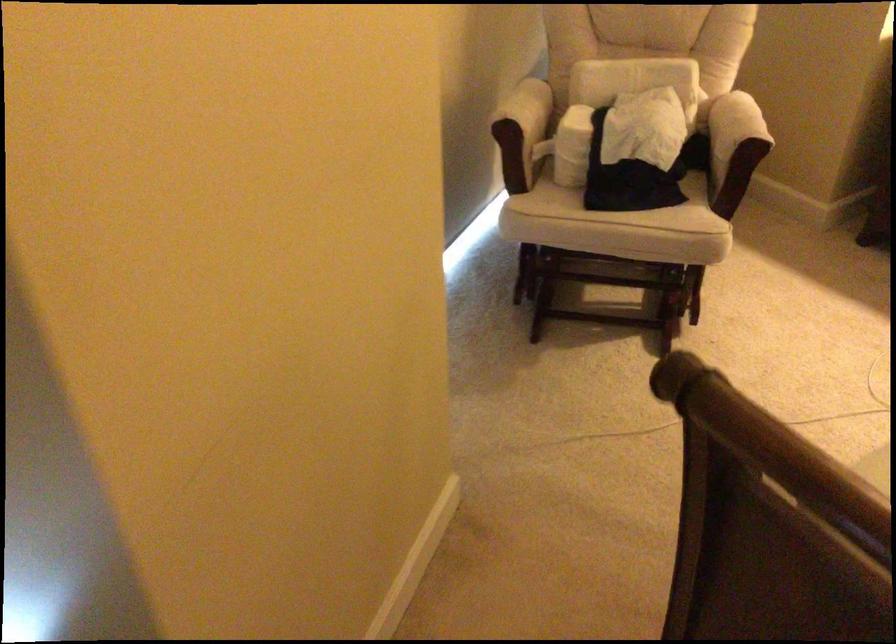
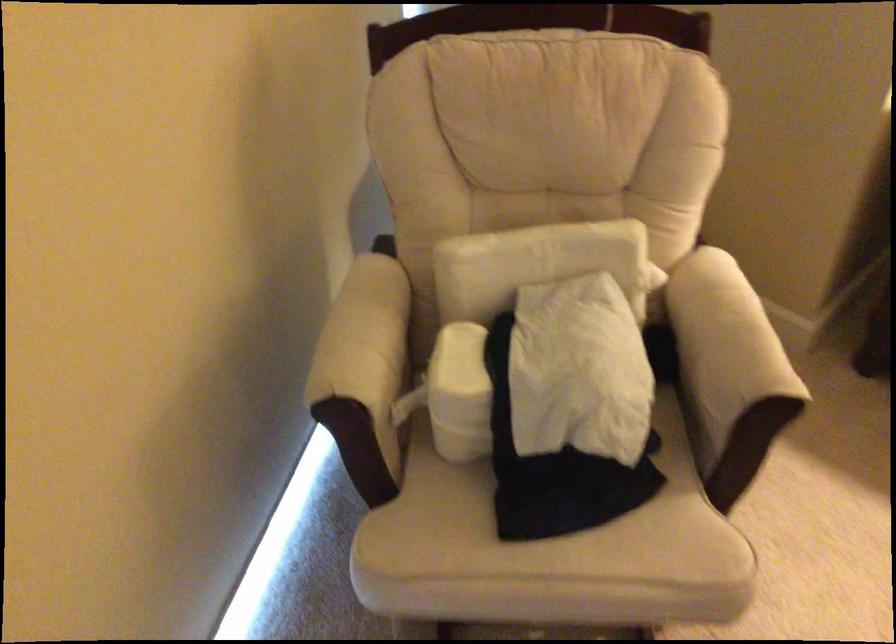
Locate, in the second image, the point that corresponds to [522,113] in the first image.

(364, 373)